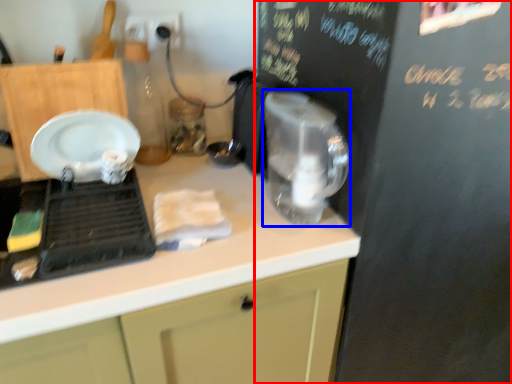
Question: Which object appears closest to the camera in this image, bulletin board (highlighted by a red box) or appliance (highlighted by a blue box)?

Choices:
 (A) bulletin board
 (B) appliance

Answer: (A)